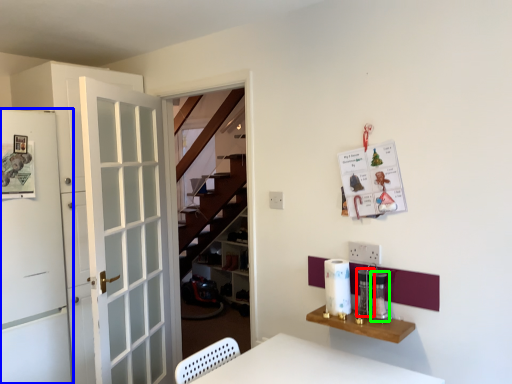
Question: Based on their relative distances, which object is farther from appliance (highlighted by a red box)? Choose from door (highlighted by a blue box) and appliance (highlighted by a green box).

Choices:
 (A) door
 (B) appliance

Answer: (A)